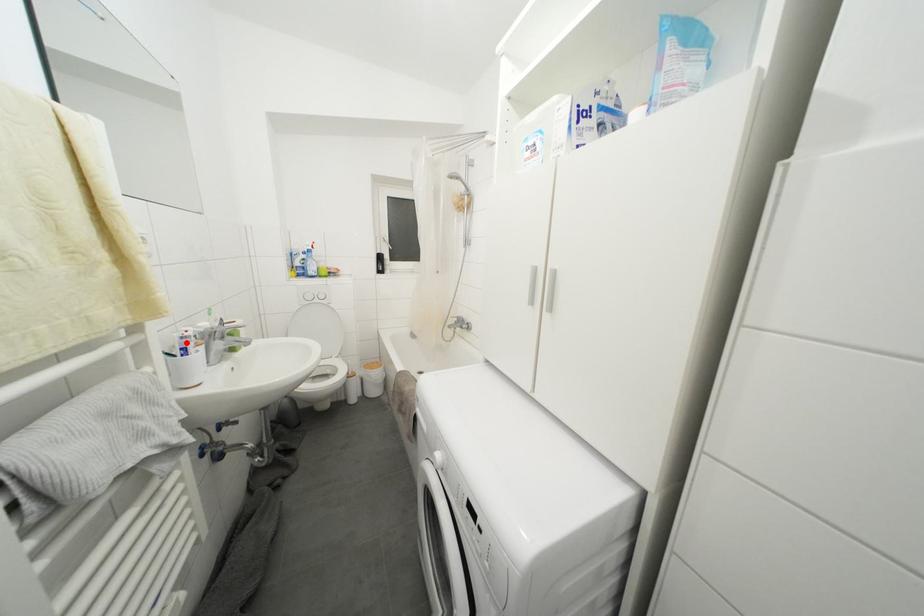
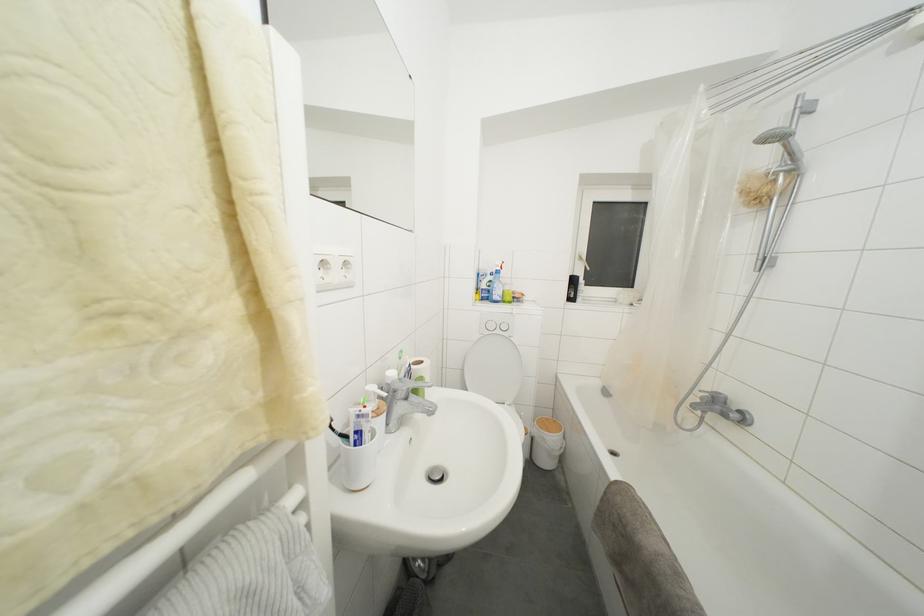
Find the pixel in the second image that matches the highlighted location in the first image.

(362, 421)